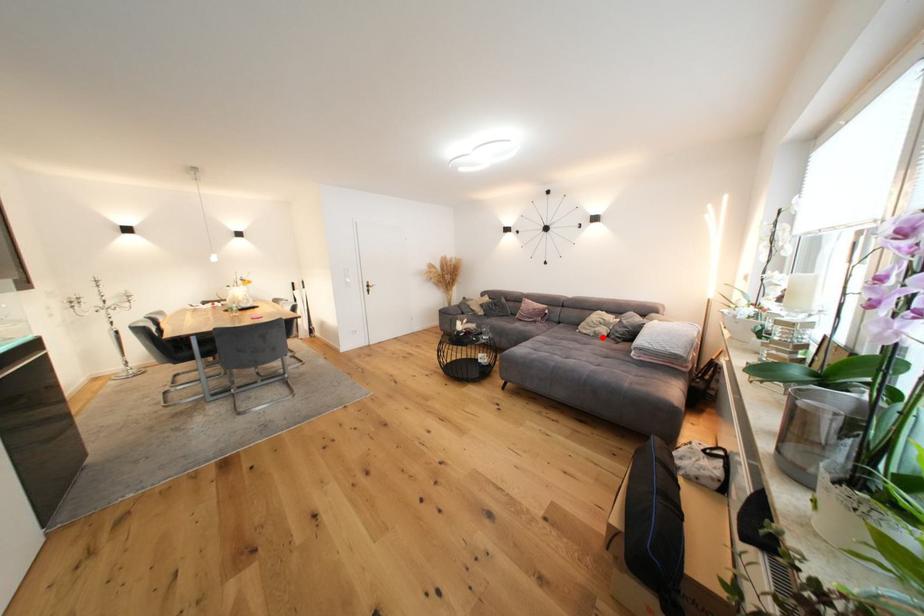
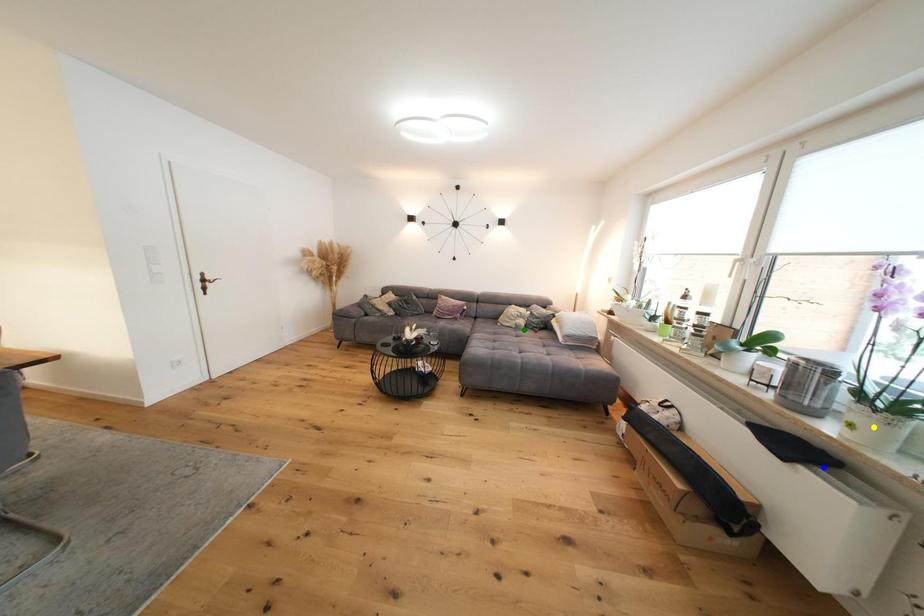
Question: I am providing you with two images of the same scene from different viewpoints. A red point is marked on the first image. You are given multiple points on the second image. Which spot in image 2 lines up with the point in image 1?

Choices:
 (A) blue point
 (B) yellow point
 (C) green point

Answer: (C)